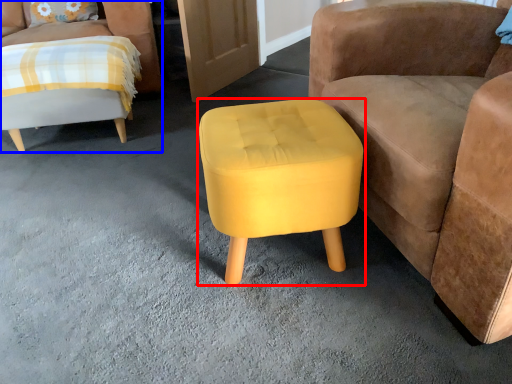
Question: Which object is further to the camera taking this photo, stool (highlighted by a red box) or chair (highlighted by a blue box)?

Choices:
 (A) stool
 (B) chair

Answer: (B)